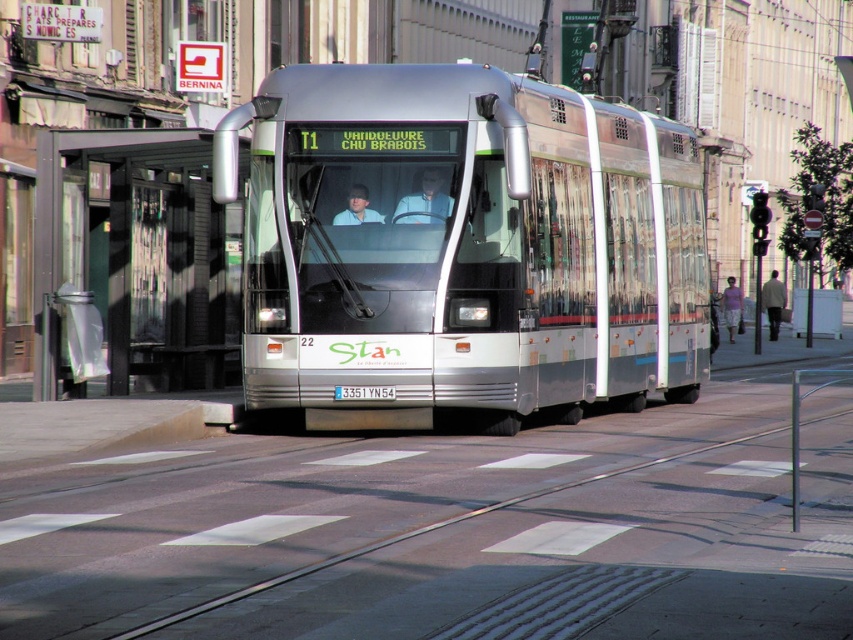
You are a tram engineer inspecting the tram and its tracks. Based on the scene, is the metallic track at center positioned under the silver metallic tram at center?

Yes, the metallic track at center is below silver metallic tram at center, so the track is indeed positioned under the silver metallic tram at center.

You are a city planner assessing the tram infrastructure. The metallic track at center and the black metal bus stop at center are both in the same area. Which one has a greater width?

The metallic track at center has a greater width than the black metal bus stop at center.

You are a city planner reviewing the tram infrastructure. The metallic track at center and the silver metallic tram at center are part of the same system. Which object is taller?

The silver metallic tram at center is taller than the metallic track at center.